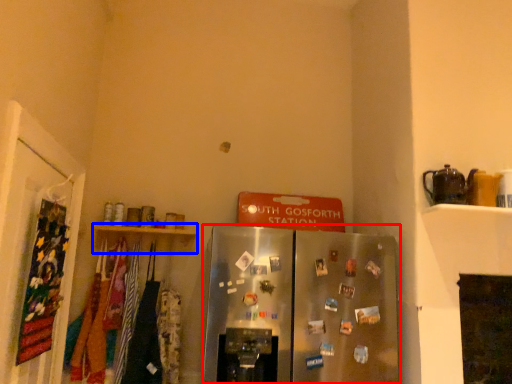
Question: Which object is closer to the camera taking this photo, refrigerator (highlighted by a red box) or shelf (highlighted by a blue box)?

Choices:
 (A) refrigerator
 (B) shelf

Answer: (A)